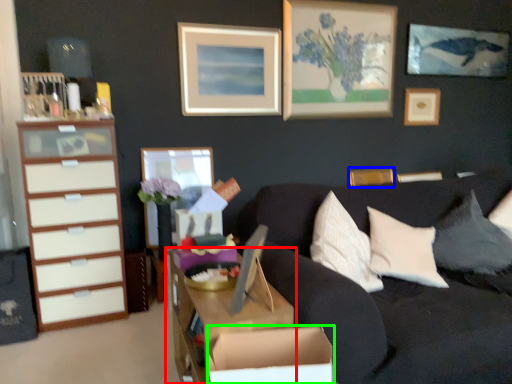
Question: Which object is positioned farthest from desk (highlighted by a red box)? Select from picture frame (highlighted by a blue box) and cardboard box (highlighted by a green box).

Choices:
 (A) picture frame
 (B) cardboard box

Answer: (A)